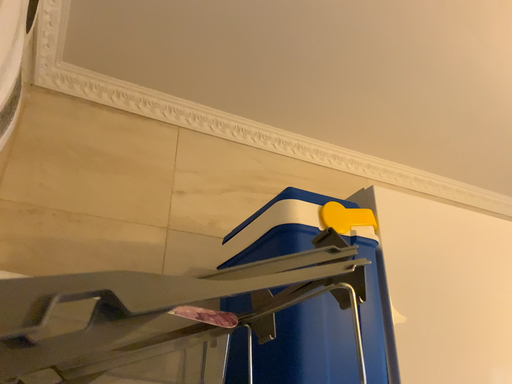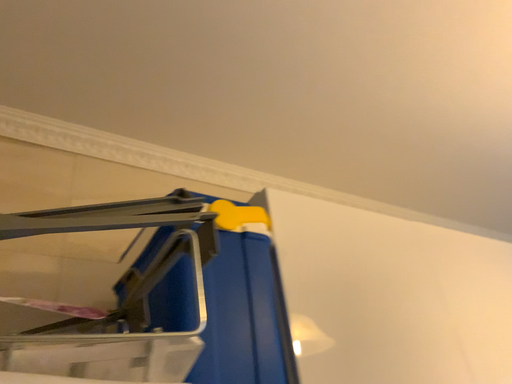
Question: Which way did the camera rotate in the video?

Choices:
 (A) rotated upward
 (B) rotated downward

Answer: (A)